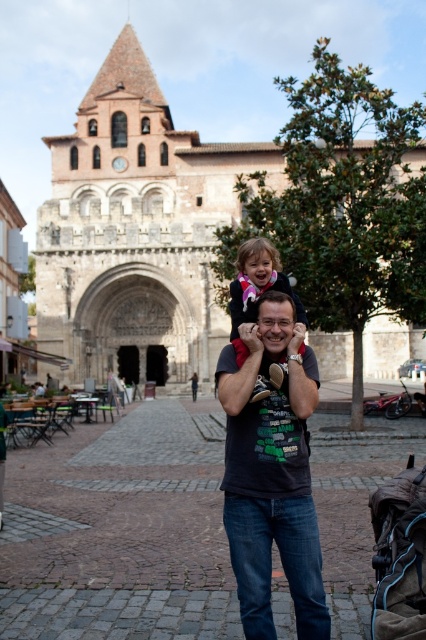
You are a photographer wanting to capture a photo of the matte pink sweater at center and the brown fabric baby carriage at lower right. Which object should you focus on first if you want to ensure both are in the frame without moving the camera?

The brown fabric baby carriage at lower right is below the matte pink sweater at center, so you should focus on the matte pink sweater at center first to ensure both are in the frame without moving the camera.

You are a photographer standing in front of the brown stone church at center and the brown fabric baby carriage at lower right. You want to take a photo that includes both the church and the baby carriage. Which object should be placed closer to the camera to ensure both are in the frame?

The brown fabric baby carriage at lower right should be placed closer to the camera because the brown stone church at center is positioned over it, meaning the church is further away. By moving the baby carriage forward, both objects can be captured in the frame.